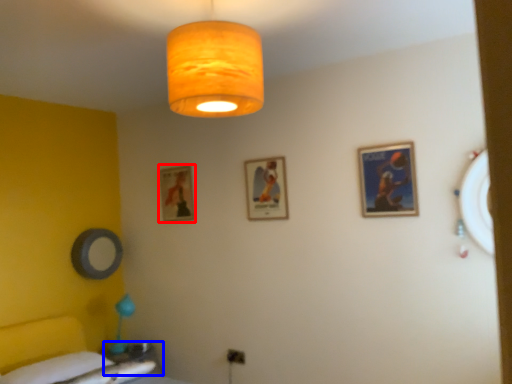
Question: Which object is closer to the camera taking this photo, picture frame (highlighted by a red box) or table (highlighted by a blue box)?

Choices:
 (A) picture frame
 (B) table

Answer: (B)